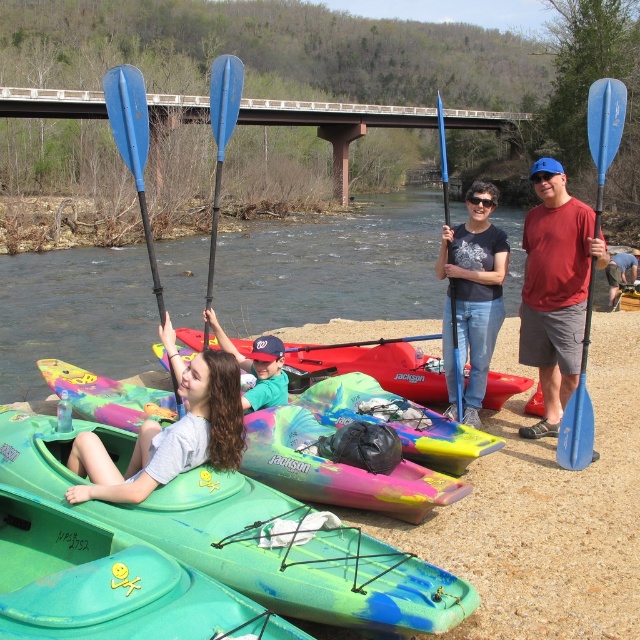
Image resolution: width=640 pixels, height=640 pixels. Describe the element at coordinates (556, 289) in the screenshot. I see `matte red t-shirt at center` at that location.

Measure the distance between point (579, 256) and camera.

The distance of point (579, 256) from camera is 6.89 meters.

Where is `matte red t-shirt at center`? matte red t-shirt at center is located at coordinates coord(556,289).

Between green plastic kayak at lower left and matte red t-shirt at center, which one has more height?

matte red t-shirt at center

Can you confirm if green plastic kayak at lower left is smaller than matte red t-shirt at center?

Indeed, green plastic kayak at lower left has a smaller size compared to matte red t-shirt at center.

This screenshot has height=640, width=640. I want to click on green plastic kayak at lower left, so click(x=337, y=468).

Is matte black t-shirt at center bigger than blue plastic paddle at upper center?

Actually, matte black t-shirt at center might be smaller than blue plastic paddle at upper center.

Can you confirm if matte black t-shirt at center is positioned above blue plastic paddle at upper center?

Incorrect, matte black t-shirt at center is not positioned above blue plastic paddle at upper center.

Is point (486, 260) closer to viewer compared to point (216, 112)?

No, (486, 260) is behind (216, 112).

In order to click on matte black t-shirt at center in this screenshot , I will do `click(476, 288)`.